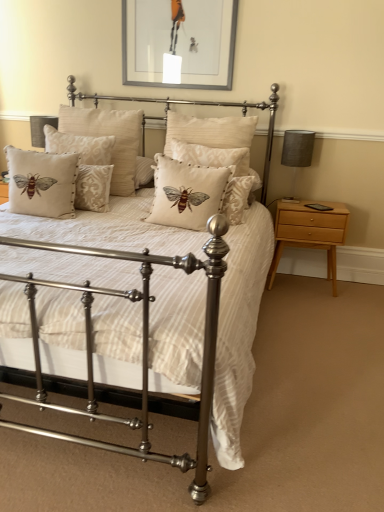
The width and height of the screenshot is (384, 512). Describe the element at coordinates (297, 153) in the screenshot. I see `gray fabric lampshade at right` at that location.

In order to face beige fabric cushion with embroidered bee at center, the second pillow in the right-to-left sequence, should I rotate leftwards or rightwards?

You should rotate right by 0.531 degrees.

What are the coordinates of `matte gray picture frame at upper center` in the screenshot? It's located at (179, 42).

The height and width of the screenshot is (512, 384). Describe the element at coordinates (179, 42) in the screenshot. I see `matte gray picture frame at upper center` at that location.

Where is `beige damask pillow at upper left, which is the 2th pillow in left-to-right order`? This screenshot has height=512, width=384. beige damask pillow at upper left, which is the 2th pillow in left-to-right order is located at coordinates (86, 166).

Which of these two, matte gray picture frame at upper center or light wood/finish nightstand at right, stands shorter?

With less height is matte gray picture frame at upper center.

Is light wood/finish nightstand at right a part of matte gray picture frame at upper center?

Actually, light wood/finish nightstand at right is outside matte gray picture frame at upper center.

Considering the points (200, 20) and (331, 228), which point is behind, point (200, 20) or point (331, 228)?

Positioned behind is point (200, 20).

Is the surface of matte gray picture frame at upper center in direct contact with light wood/finish nightstand at right?

No, matte gray picture frame at upper center is not in contact with light wood/finish nightstand at right.

From their relative heights in the image, would you say light wood/finish nightstand at right is taller or shorter than beige fabric cushion with embroidered bee at center, positioned as the 4th pillow in left-to-right order?

In the image, light wood/finish nightstand at right appears to be taller than beige fabric cushion with embroidered bee at center, positioned as the 4th pillow in left-to-right order.

Between light wood/finish nightstand at right and beige fabric cushion with embroidered bee at center, positioned as the 4th pillow in left-to-right order, which one appears on the left side from the viewer's perspective?

beige fabric cushion with embroidered bee at center, positioned as the 4th pillow in left-to-right order, is more to the left.

Is point (292, 222) in front of point (225, 170)?

No, it is behind (225, 170).

Are beige fabric cushion with bee design at center, the 3th pillow when ordered from left to right, and beige fabric cushion with embroidered bee at center, which is counted as the 1th pillow, starting from the right, beside each other?

There is a gap between beige fabric cushion with bee design at center, the 3th pillow when ordered from left to right, and beige fabric cushion with embroidered bee at center, which is counted as the 1th pillow, starting from the right.

Is beige fabric cushion with bee design at center, the 3th pillow when ordered from left to right, looking in the opposite direction of beige fabric cushion with embroidered bee at center, positioned as the fifth pillow in left-to-right order?

No, beige fabric cushion with bee design at center, the 3th pillow when ordered from left to right, is not facing the opposite direction of beige fabric cushion with embroidered bee at center, positioned as the fifth pillow in left-to-right order.

Visually, is beige fabric cushion with bee design at center, the third pillow when ordered from right to left, positioned to the left or to the right of beige fabric cushion with embroidered bee at center, which is counted as the 1th pillow, starting from the right?

From the image, it's evident that beige fabric cushion with bee design at center, the third pillow when ordered from right to left, is to the left of beige fabric cushion with embroidered bee at center, which is counted as the 1th pillow, starting from the right.

What's the angular difference between gray fabric lampshade at right and beige fabric cushion with bee design at center, the third pillow when ordered from right to left,'s facing directions?

0.142 degrees.

In the scene shown: Does gray fabric lampshade at right contain beige fabric cushion with bee design at center, the third pillow when ordered from right to left?

That's incorrect, beige fabric cushion with bee design at center, the third pillow when ordered from right to left, is not inside gray fabric lampshade at right.

From the image's perspective, is gray fabric lampshade at right located above or below beige fabric cushion with bee design at center, the third pillow when ordered from right to left?

gray fabric lampshade at right is situated lower than beige fabric cushion with bee design at center, the third pillow when ordered from right to left, in the image.

Considering the positions of objects matte silver bed at center and beige fabric cushion with embroidered bee at left, positioned as the 1th pillow in left-to-right order, in the image provided, who is more to the left, matte silver bed at center or beige fabric cushion with embroidered bee at left, positioned as the 1th pillow in left-to-right order,?

beige fabric cushion with embroidered bee at left, positioned as the 1th pillow in left-to-right order.

Would you consider matte silver bed at center to be distant from beige fabric cushion with embroidered bee at left, which ranks as the fifth pillow in right-to-left order?

No, there isn't a large distance between matte silver bed at center and beige fabric cushion with embroidered bee at left, which ranks as the fifth pillow in right-to-left order.

Which of these two, matte silver bed at center or beige fabric cushion with embroidered bee at left, positioned as the 1th pillow in left-to-right order, is smaller?

beige fabric cushion with embroidered bee at left, positioned as the 1th pillow in left-to-right order, is smaller.

Considering the positions of objects beige fabric cushion with embroidered bee at center, positioned as the fifth pillow in left-to-right order, and beige damask pillow at upper left, which appears as the fourth pillow when viewed from the right, in the image provided, who is in front, beige fabric cushion with embroidered bee at center, positioned as the fifth pillow in left-to-right order, or beige damask pillow at upper left, which appears as the fourth pillow when viewed from the right,?

beige fabric cushion with embroidered bee at center, positioned as the fifth pillow in left-to-right order, is closer to the camera.

Is beige fabric cushion with embroidered bee at center, positioned as the fifth pillow in left-to-right order, oriented towards beige damask pillow at upper left, which appears as the fourth pillow when viewed from the right?

No, beige fabric cushion with embroidered bee at center, positioned as the fifth pillow in left-to-right order, is not oriented towards beige damask pillow at upper left, which appears as the fourth pillow when viewed from the right.

Who is smaller, beige fabric cushion with embroidered bee at center, positioned as the fifth pillow in left-to-right order, or beige damask pillow at upper left, which is the 2th pillow in left-to-right order?

beige fabric cushion with embroidered bee at center, positioned as the fifth pillow in left-to-right order.

Considering the positions of point (238, 221) and point (104, 195), is point (238, 221) closer or farther from the camera than point (104, 195)?

Point (238, 221).

How different are the orientations of beige damask pillow at upper left, which appears as the fourth pillow when viewed from the right, and beige fabric cushion with embroidered bee at left, which ranks as the fifth pillow in right-to-left order, in degrees?

beige damask pillow at upper left, which appears as the fourth pillow when viewed from the right, and beige fabric cushion with embroidered bee at left, which ranks as the fifth pillow in right-to-left order, are facing 0.00075 degrees away from each other.

Considering the positions of objects beige damask pillow at upper left, which appears as the fourth pillow when viewed from the right, and beige fabric cushion with embroidered bee at left, positioned as the 1th pillow in left-to-right order, in the image provided, who is in front, beige damask pillow at upper left, which appears as the fourth pillow when viewed from the right, or beige fabric cushion with embroidered bee at left, positioned as the 1th pillow in left-to-right order,?

beige fabric cushion with embroidered bee at left, positioned as the 1th pillow in left-to-right order, is closer to the camera.

This screenshot has height=512, width=384. Find the location of `the 2nd pillow located beneath the beige damask pillow at upper left, which is the 2th pillow in left-to-right order (from a real-world perspective)`. the 2nd pillow located beneath the beige damask pillow at upper left, which is the 2th pillow in left-to-right order (from a real-world perspective) is located at coordinates (42, 183).

Which is more to the right, beige damask pillow at upper left, which is the 2th pillow in left-to-right order, or beige fabric cushion with embroidered bee at left, which ranks as the fifth pillow in right-to-left order?

beige damask pillow at upper left, which is the 2th pillow in left-to-right order, is more to the right.

The height and width of the screenshot is (512, 384). In order to click on nightstand that is on the right side of matte gray picture frame at upper center in this screenshot , I will do `click(309, 232)`.

At what (x,y) coordinates should I click in order to perform the action: click on nightstand behind the beige fabric cushion with embroidered bee at center, the second pillow in the right-to-left sequence. Please return your answer as a coordinate pair (x, y). This screenshot has height=512, width=384. Looking at the image, I should click on coord(309,232).

In the scene shown: Looking at the image, which one is located further to beige fabric cushion with embroidered bee at left, positioned as the 1th pillow in left-to-right order, matte gray picture frame at upper center or light wood/finish nightstand at right?

Among the two, light wood/finish nightstand at right is located further to beige fabric cushion with embroidered bee at left, positioned as the 1th pillow in left-to-right order.

From the image, which object appears to be farther from light wood/finish nightstand at right, beige damask pillow at upper left, which appears as the fourth pillow when viewed from the right, or matte silver bed at center?

Based on the image, matte silver bed at center appears to be further to light wood/finish nightstand at right.

In the scene shown: Estimate the real-world distances between objects in this image. Which object is closer to beige fabric cushion with embroidered bee at left, positioned as the 1th pillow in left-to-right order, gray fabric lampshade at right or matte silver bed at center?

The object closer to beige fabric cushion with embroidered bee at left, positioned as the 1th pillow in left-to-right order, is matte silver bed at center.

When comparing their distances from light wood/finish nightstand at right, does beige fabric cushion with embroidered bee at left, positioned as the 1th pillow in left-to-right order, or beige fabric cushion with embroidered bee at center, which is counted as the 1th pillow, starting from the right, seem closer?

Based on the image, beige fabric cushion with embroidered bee at center, which is counted as the 1th pillow, starting from the right, appears to be nearer to light wood/finish nightstand at right.

From the image, which object appears to be nearer to beige damask pillow at upper left, which is the 2th pillow in left-to-right order, beige fabric cushion with bee design at center, the third pillow when ordered from right to left, or beige fabric cushion with embroidered bee at left, positioned as the 1th pillow in left-to-right order?

Based on the image, beige fabric cushion with bee design at center, the third pillow when ordered from right to left, appears to be nearer to beige damask pillow at upper left, which is the 2th pillow in left-to-right order.

Estimate the real-world distances between objects in this image. Which object is closer to matte gray picture frame at upper center, light wood/finish nightstand at right or gray fabric lampshade at right?

The object closer to matte gray picture frame at upper center is gray fabric lampshade at right.

Considering their positions, is beige fabric cushion with bee design at center, the third pillow when ordered from right to left, positioned closer to light wood/finish nightstand at right than matte gray picture frame at upper center?

The object closer to light wood/finish nightstand at right is beige fabric cushion with bee design at center, the third pillow when ordered from right to left.

When comparing their distances from beige fabric cushion with bee design at center, the 3th pillow when ordered from left to right, does beige fabric cushion with embroidered bee at center, the second pillow in the right-to-left sequence, or gray fabric lampshade at right seem closer?

Based on the image, beige fabric cushion with embroidered bee at center, the second pillow in the right-to-left sequence, appears to be nearer to beige fabric cushion with bee design at center, the 3th pillow when ordered from left to right.

What are the coordinates of `picture frame between beige fabric cushion with embroidered bee at left, which ranks as the fifth pillow in right-to-left order, and gray fabric lampshade at right from left to right` in the screenshot? It's located at (179, 42).

I want to click on picture frame located between matte silver bed at center and gray fabric lampshade at right in the depth direction, so click(x=179, y=42).

I want to click on picture frame positioned between matte silver bed at center and light wood/finish nightstand at right from near to far, so click(179, 42).

Identify the location of picture frame located between beige fabric cushion with bee design at center, the third pillow when ordered from right to left, and gray fabric lampshade at right in the left-right direction. The height and width of the screenshot is (512, 384). (179, 42).